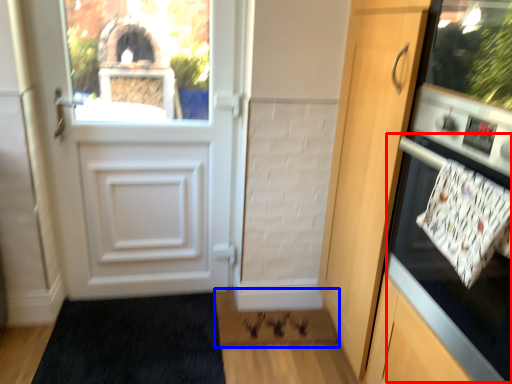
Question: Which point is closer to the camera, oven (highlighted by a red box) or doormat (highlighted by a blue box)?

Choices:
 (A) oven
 (B) doormat

Answer: (A)